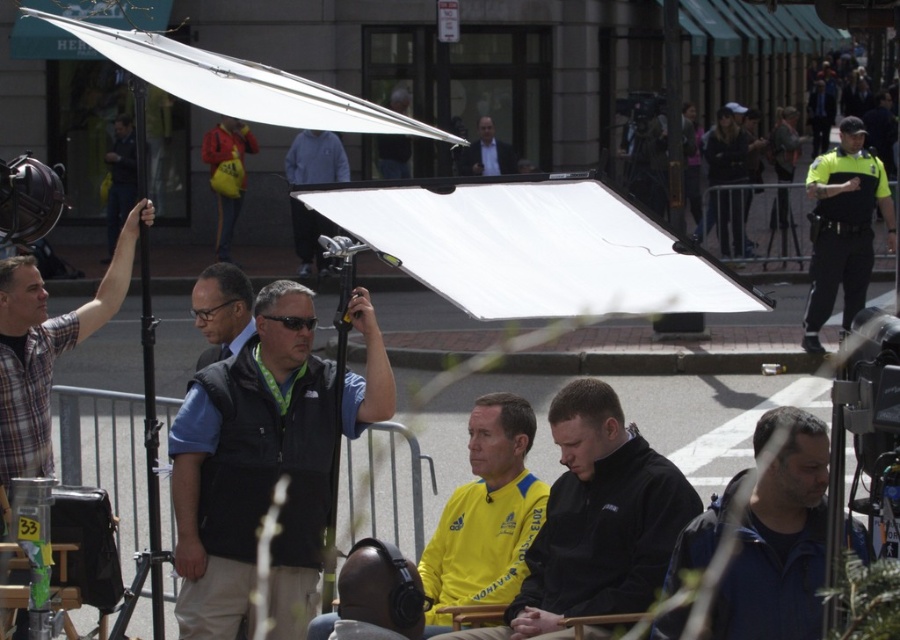
You are an actor waiting to film your scene. You see the yellow fabric shirt at center and the black matte headphones at center in the middle ground. Which one is positioned more to the east?

The yellow fabric shirt at center is to the right of black matte headphones at center, so the yellow fabric shirt at center is positioned more to the east.

You are a costume designer looking for the yellow fabric shirt at center in a crowded outdoor film set. Using the coordinate system where the bottom left corner is the origin, can you confirm if the yellow fabric shirt at center is located at point (596, 520)?

The yellow fabric shirt at center is represented by point (596, 520).

Looking at this image, you are a costume designer observing the scene. You need to determine which item is wider between the yellow fabric shirt at center and the black matte headphones at center. Which one is wider?

The yellow fabric shirt at center is wider than the black matte headphones at center according to the description.